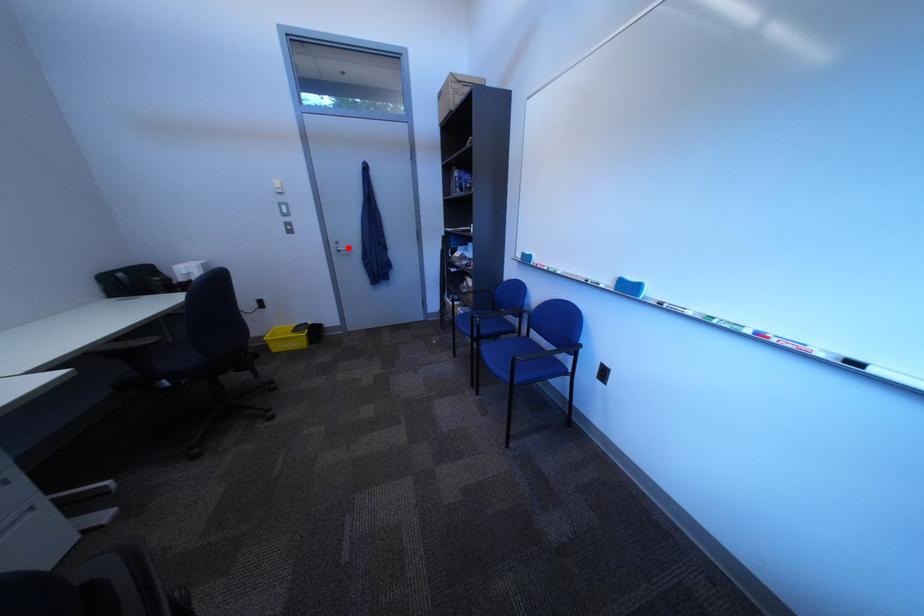
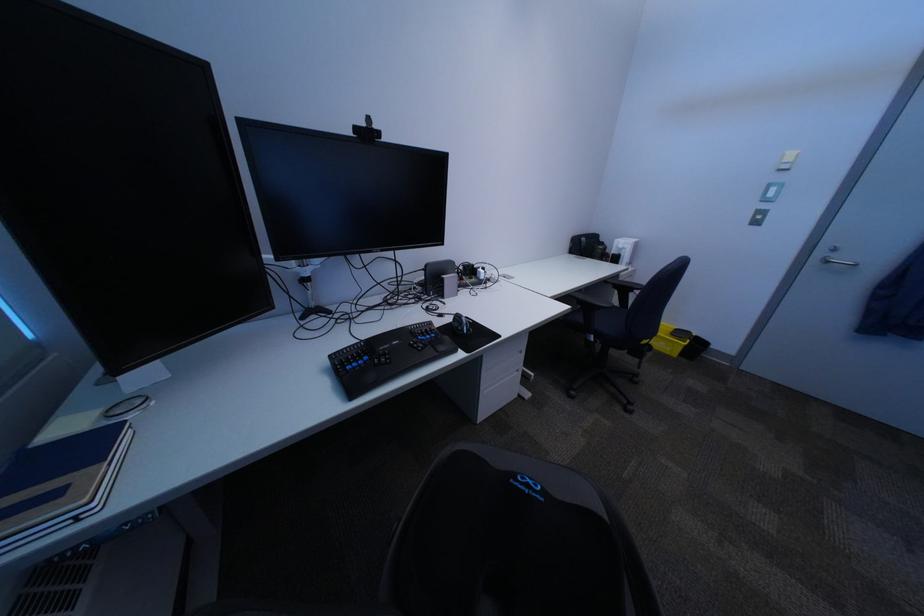
Question: I am providing you with two images of the same scene from different viewpoints. Given a red point in image1, look at the same physical point in image2. Is it:

Choices:
 (A) Closer to the viewpoint
 (B) Farther from the viewpoint

Answer: (B)